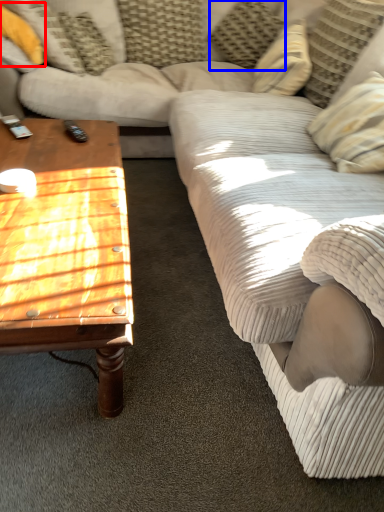
Question: Which object appears farthest to the camera in this image, pillow (highlighted by a red box) or pillow (highlighted by a blue box)?

Choices:
 (A) pillow
 (B) pillow

Answer: (B)